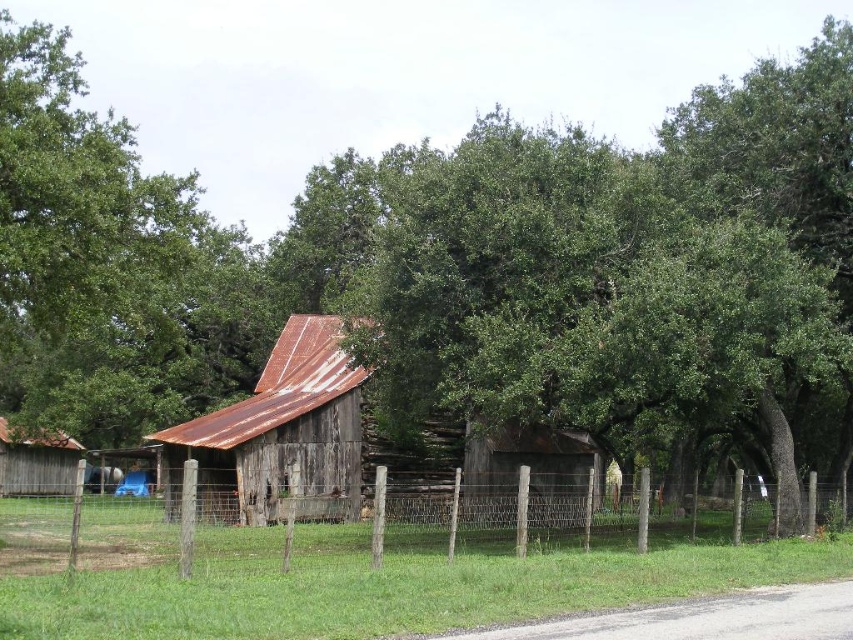
You are standing in front of the old wooden barn and want to determine which of the two points, point (57, 138) or point (264, 548), is nearer to you. Based on the scene description, which point is closer?

Point (57, 138) is closer to the viewer than point (264, 548).

You are standing in the middle of a field and see the wooden fence at center and the rusty wood barn at center. Which object is closer to you?

The wooden fence at center is closer because it is in front of the rusty wood barn at center.

In the scene shown: You are an artist setting up an easel to paint the green leafy tree at upper left and the wooden fence at center. Given that your canvas can only accommodate one of them in full view, which object should you choose to paint based on their size?

The green leafy tree at upper left is bigger than the wooden fence at center, so you should choose to paint the green leafy tree at upper left to ensure it fits on the canvas.